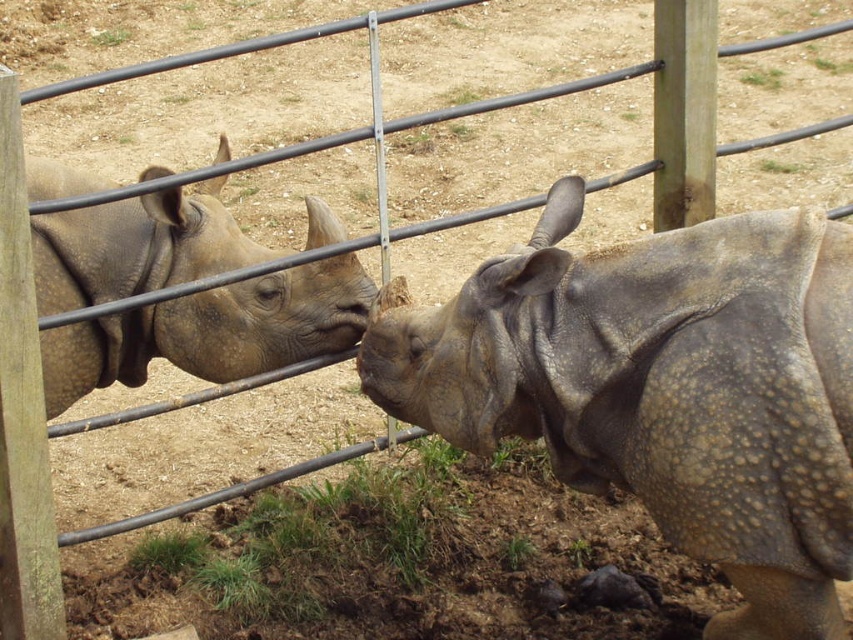
Between leathery gray rhino at center and matte gray rhino at left, which one appears on the right side from the viewer's perspective?

leathery gray rhino at center is more to the right.

Who is more distant from viewer, (747, 410) or (165, 348)?

The point (165, 348) is more distant.

The image size is (853, 640). I want to click on leathery gray rhino at center, so click(660, 388).

Identify the location of leathery gray rhino at center. Image resolution: width=853 pixels, height=640 pixels. (660, 388).